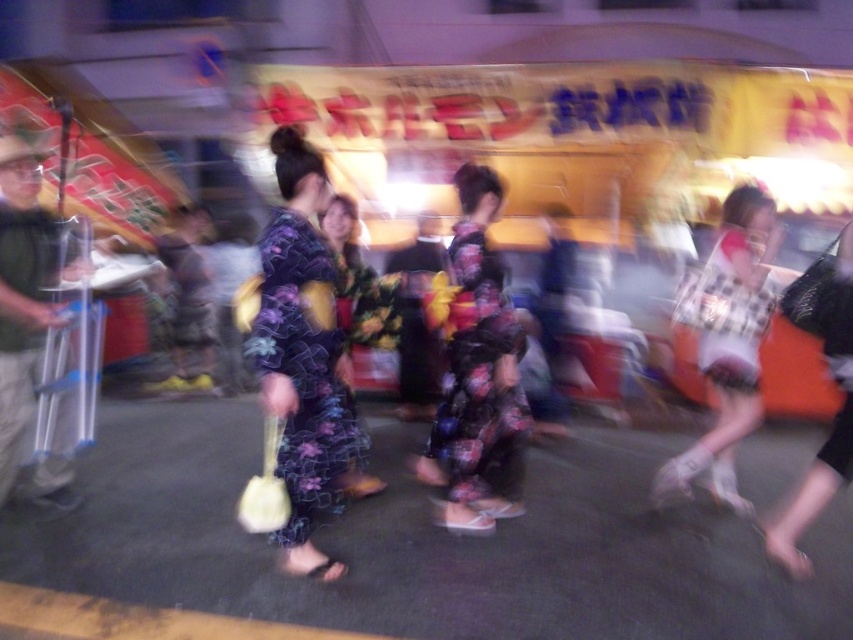
Based on the photo, you are a photographer trying to capture both the floral silk kimono at center and the floral fabric dress at center in a single frame. Which one should you focus on first to ensure it appears taller in the photo?

The floral fabric dress at center is taller than the floral silk kimono at center, so focusing on the floral fabric dress at center first would ensure it appears taller in the photo.

You are standing in the street scene and want to determine which of the two points, point (474, 369) or point (676, 477), is nearer to you. Based on the image, which point is closer?

Point (474, 369) is closer to the viewer than point (676, 477).